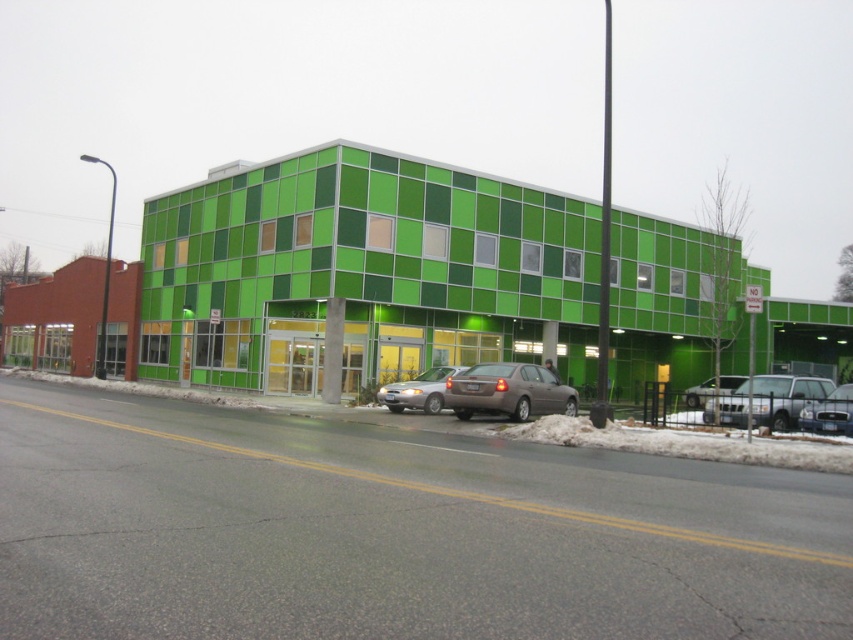
Which is above, matte gray sedan at center or shiny silver sedan at center?

matte gray sedan at center is higher up.

Between matte gray sedan at center and shiny silver sedan at center, which one appears on the left side from the viewer's perspective?

matte gray sedan at center

In order to click on matte gray sedan at center in this screenshot , I will do `click(508, 392)`.

The image size is (853, 640). Find the location of `matte gray sedan at center`. matte gray sedan at center is located at coordinates (508, 392).

Can you confirm if matte gray sedan at center is taller than silver metallic sedan at right?

In fact, matte gray sedan at center may be shorter than silver metallic sedan at right.

Who is positioned more to the left, matte gray sedan at center or silver metallic sedan at right?

From the viewer's perspective, matte gray sedan at center appears more on the left side.

Locate an element on the screen. matte gray sedan at center is located at coordinates (508, 392).

Identify the location of matte gray sedan at center. (508, 392).

Is satin silver sedan at center to the right of matte silver sedan at center from the viewer's perspective?

No, satin silver sedan at center is not to the right of matte silver sedan at center.

Is satin silver sedan at center shorter than matte silver sedan at center?

Indeed, satin silver sedan at center has a lesser height compared to matte silver sedan at center.

Does point (412, 408) lie behind point (720, 374)?

No, it is not.

What are the coordinates of `satin silver sedan at center` in the screenshot? It's located at (418, 390).